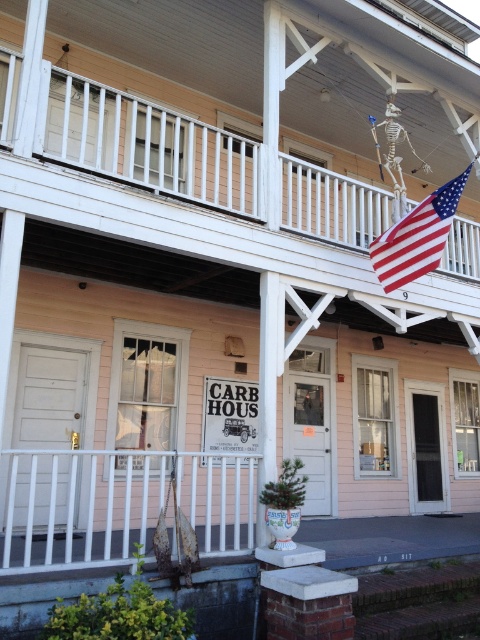
Does white metal rail at lower left appear on the left side of american flag at upper right?

Yes, white metal rail at lower left is to the left of american flag at upper right.

Does white metal rail at lower left come in front of american flag at upper right?

Yes, it is in front of american flag at upper right.

Is point (31, 556) positioned after point (456, 180)?

No, it is in front of (456, 180).

Find the location of a particular element. This screenshot has height=640, width=480. white metal rail at lower left is located at coordinates (120, 502).